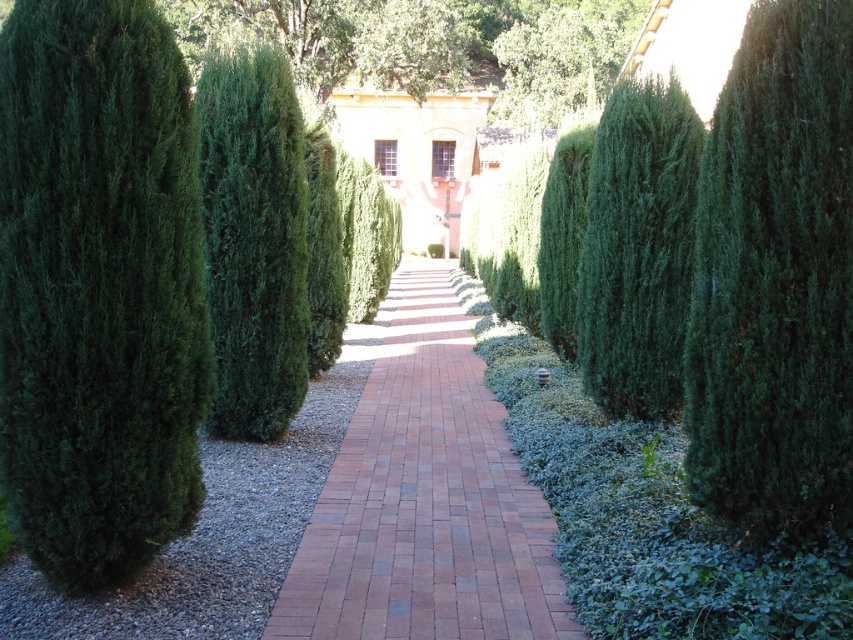
Is green dense shrub at left to the left of green leafy tree at center from the viewer's perspective?

Indeed, green dense shrub at left is positioned on the left side of green leafy tree at center.

Who is shorter, green dense shrub at left or green leafy tree at center?

Standing shorter between the two is green dense shrub at left.

Does point (62, 160) lie in front of point (207, 3)?

Yes, it is.

Identify the location of green dense shrub at left. This screenshot has width=853, height=640. (97, 289).

Between brick at center and green leafy tree at center, which one appears on the right side from the viewer's perspective?

Positioned to the right is green leafy tree at center.

Between brick at center and green leafy tree at center, which one is positioned higher?

green leafy tree at center is higher up.

Which is in front, point (289, 612) or point (521, 17)?

Positioned in front is point (289, 612).

At what (x,y) coordinates should I click in order to perform the action: click on brick at center. Please return your answer as a coordinate pair (x, y). The height and width of the screenshot is (640, 853). Looking at the image, I should click on (425, 499).

Image resolution: width=853 pixels, height=640 pixels. What do you see at coordinates (97, 289) in the screenshot? I see `green dense shrub at left` at bounding box center [97, 289].

Who is taller, green dense shrub at left or brick at center?

Standing taller between the two is green dense shrub at left.

Which is in front, point (160, 289) or point (335, 506)?

Point (160, 289)

Locate an element on the screen. green dense shrub at left is located at coordinates (97, 289).